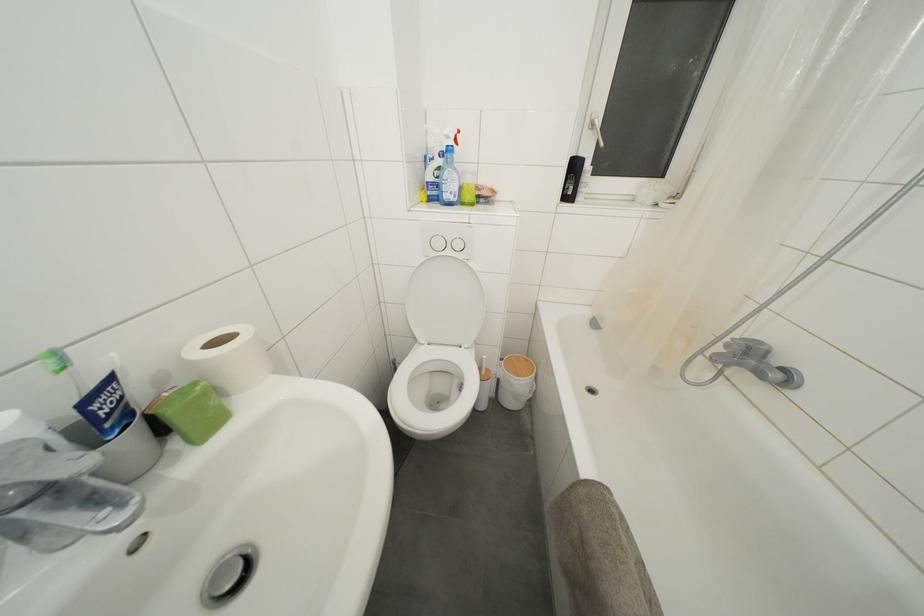
The location [228,359] corresponds to which object?

It corresponds to the toilet paper roll in the image.